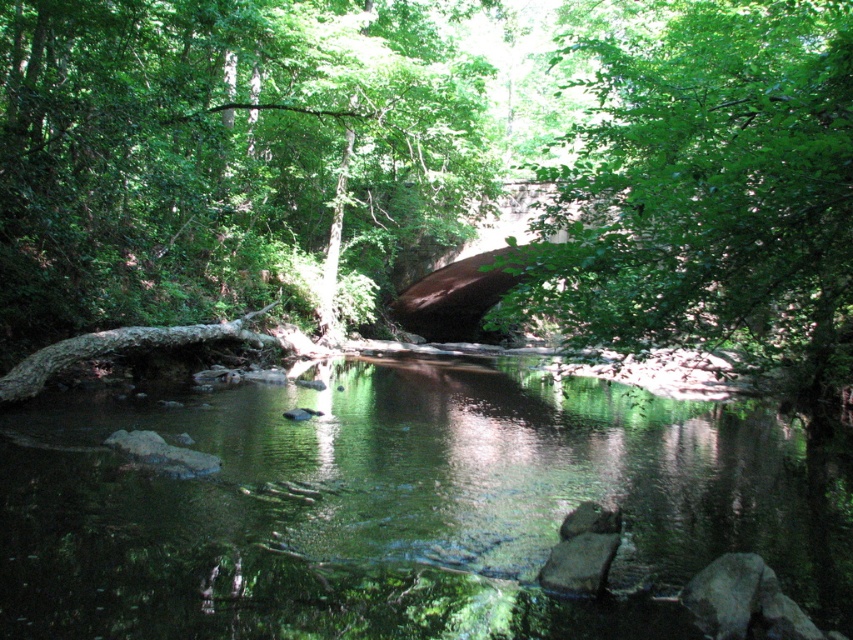
Does green leafy tree at center have a lesser width compared to green leafy tree at upper center?

Incorrect, green leafy tree at center's width is not less than green leafy tree at upper center's.

Describe the element at coordinates (229, 157) in the screenshot. I see `green leafy tree at center` at that location.

I want to click on green leafy tree at center, so click(x=229, y=157).

Can you confirm if green leafy tree at center is shorter than brown rough log at left?

In fact, green leafy tree at center may be taller than brown rough log at left.

Between point (302, 77) and point (260, 339), which one is positioned behind?

Positioned behind is point (302, 77).

Find the location of `green leafy tree at center`. green leafy tree at center is located at coordinates (229, 157).

Measure the distance between green reflective water at center and green leafy tree at center.

green reflective water at center is 10.47 meters from green leafy tree at center.

Who is positioned more to the right, green reflective water at center or green leafy tree at center?

green reflective water at center

Is point (749, 451) positioned behind point (260, 284)?

No, (749, 451) is in front of (260, 284).

Image resolution: width=853 pixels, height=640 pixels. Identify the location of green reflective water at center. (x=405, y=506).